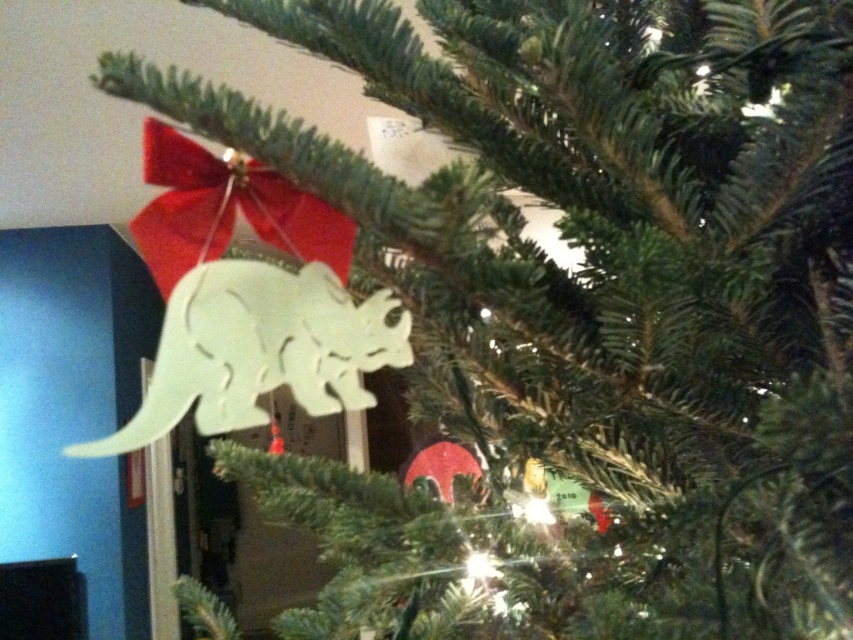
Between white matte wood dinosaur at center and matte white dinosaur at upper center, which one is positioned lower?

Positioned lower is white matte wood dinosaur at center.

Based on the photo, can you confirm if white matte wood dinosaur at center is wider than matte white dinosaur at upper center?

Yes.

Locate an element on the screen. The width and height of the screenshot is (853, 640). white matte wood dinosaur at center is located at coordinates (259, 349).